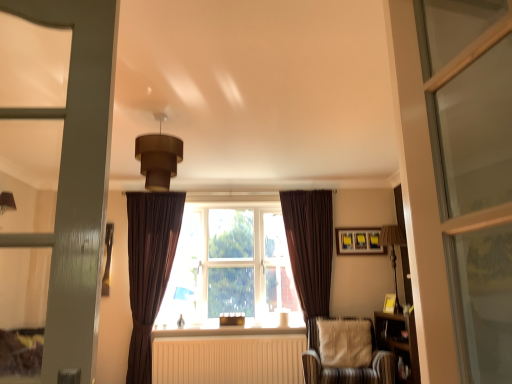
Image resolution: width=512 pixels, height=384 pixels. Describe the element at coordinates (149, 269) in the screenshot. I see `brown velvet curtain at left, the 2th curtain viewed from the right` at that location.

Where is `brown matte/soft pendant light at upper center, the first light fixture positioned from the front`? brown matte/soft pendant light at upper center, the first light fixture positioned from the front is located at coordinates (158, 157).

This screenshot has height=384, width=512. What do you see at coordinates (359, 241) in the screenshot?
I see `matte yellow picture frame at upper right` at bounding box center [359, 241].

Measure the distance between striped fabric chair at lower right and camera.

striped fabric chair at lower right is 3.59 meters away from camera.

Describe the element at coordinates (393, 251) in the screenshot. The height and width of the screenshot is (384, 512). I see `wooden lampshade at right, marked as the 2th light fixture in a front-to-back arrangement` at that location.

Image resolution: width=512 pixels, height=384 pixels. Find the location of `brown fabric window at center`. brown fabric window at center is located at coordinates (231, 268).

I want to click on brown velvet curtain at left, which is the first curtain from left to right, so click(149, 269).

From a real-world perspective, relative to white matte radiator at center, is matte yellow picture frame at upper right vertically above or below?

Clearly, from a real-world perspective, matte yellow picture frame at upper right is above white matte radiator at center.

Based on the photo, which of these two, matte yellow picture frame at upper right or white matte radiator at center, is smaller?

Smaller between the two is matte yellow picture frame at upper right.

Based on the photo, from the image's perspective, relative to white matte radiator at center, is matte yellow picture frame at upper right above or below?

matte yellow picture frame at upper right is above white matte radiator at center.

Which of these two, matte yellow picture frame at upper right or white matte radiator at center, is wider?

With larger width is white matte radiator at center.

Considering the points (146, 199) and (386, 337), which point is behind, point (146, 199) or point (386, 337)?

Positioned behind is point (146, 199).

Considering the sizes of brown velvet curtain at left, which is the first curtain from left to right, and wooden bookshelf at right in the image, is brown velvet curtain at left, which is the first curtain from left to right, wider or thinner than wooden bookshelf at right?

Considering their sizes, brown velvet curtain at left, which is the first curtain from left to right, looks slimmer than wooden bookshelf at right.

Looking at this image, is brown velvet curtain at left, which is the first curtain from left to right, positioned in front of wooden bookshelf at right?

That is False.

Measure the distance between brown velvet curtain at left, which is the first curtain from left to right, and wooden bookshelf at right.

The distance of brown velvet curtain at left, which is the first curtain from left to right, from wooden bookshelf at right is 2.44 meters.

Which object is closer to the camera, matte yellow picture frame at upper right or brown fabric window at center?

brown fabric window at center is closer to the camera.

Is matte yellow picture frame at upper right oriented towards brown fabric window at center?

No, matte yellow picture frame at upper right is not oriented towards brown fabric window at center.

Considering the sizes of objects matte yellow picture frame at upper right and brown fabric window at center in the image provided, who is thinner, matte yellow picture frame at upper right or brown fabric window at center?

matte yellow picture frame at upper right is thinner.

Looking at their sizes, would you say white painted wood at center is wider or thinner than striped fabric chair at lower right?

Clearly, white painted wood at center has less width compared to striped fabric chair at lower right.

From the image's perspective, is white painted wood at center above striped fabric chair at lower right?

Yes, from the image's perspective, white painted wood at center is over striped fabric chair at lower right.

From a real-world perspective, between white painted wood at center and striped fabric chair at lower right, who is vertically higher?

white painted wood at center.

Does point (282, 329) lie behind point (375, 363)?

Yes, point (282, 329) is farther from viewer.

From the image's perspective, between matte yellow picture frame at upper right and striped fabric chair at lower right, which one is located above?

matte yellow picture frame at upper right, from the image's perspective.

Is matte yellow picture frame at upper right next to striped fabric chair at lower right and touching it?

No, matte yellow picture frame at upper right is not making contact with striped fabric chair at lower right.

Between matte yellow picture frame at upper right and striped fabric chair at lower right, which one has larger size?

With larger size is striped fabric chair at lower right.

Which is in front, point (366, 249) or point (182, 146)?

Point (182, 146)

Who is taller, matte yellow picture frame at upper right or brown matte/soft pendant light at upper center, which ranks as the second light fixture in right-to-left order?

brown matte/soft pendant light at upper center, which ranks as the second light fixture in right-to-left order, is taller.

Does matte yellow picture frame at upper right have a lesser width compared to brown matte/soft pendant light at upper center, which ranks as the second light fixture in right-to-left order?

Yes, matte yellow picture frame at upper right is thinner than brown matte/soft pendant light at upper center, which ranks as the second light fixture in right-to-left order.

From a real-world perspective, relative to brown matte/soft pendant light at upper center, the second light fixture in the bottom-to-top sequence, is matte yellow picture frame at upper right vertically above or below?

In terms of real-world spatial position, matte yellow picture frame at upper right is below brown matte/soft pendant light at upper center, the second light fixture in the bottom-to-top sequence.

How different are the orientations of matte yellow picture frame at upper right and brown velvet curtain at left, the 2th curtain viewed from the right, in degrees?

The angle between the facing direction of matte yellow picture frame at upper right and the facing direction of brown velvet curtain at left, the 2th curtain viewed from the right, is 1.92 degrees.

From the image's perspective, would you say matte yellow picture frame at upper right is shown under brown velvet curtain at left, which is the first curtain from left to right?

No, from the image's perspective, matte yellow picture frame at upper right is not beneath brown velvet curtain at left, which is the first curtain from left to right.

Between matte yellow picture frame at upper right and brown velvet curtain at left, which is the first curtain from left to right, which one has less height?

With less height is matte yellow picture frame at upper right.

Is brown velvet curtain at left, which is the first curtain from left to right, at the back of matte yellow picture frame at upper right?

No.

The width and height of the screenshot is (512, 384). In the image, there is a white matte radiator at center. Identify the location of picture frame above it (from the image's perspective). (359, 241).

Where is `the 2nd curtain positioned above the wooden bookshelf at right (from a real-world perspective)`? The image size is (512, 384). the 2nd curtain positioned above the wooden bookshelf at right (from a real-world perspective) is located at coordinates (149, 269).

Looking at the image, which one is located further to wooden lampshade at right, which is counted as the second light fixture, starting from the left, brown velvet curtain at right, which is the 1th curtain in right-to-left order, or brown fabric window at center?

brown fabric window at center is positioned further to the anchor wooden lampshade at right, which is counted as the second light fixture, starting from the left.

Based on their spatial positions, is wooden lampshade at right, which is counted as the 1th light fixture, starting from the back, or white painted wood at center further from white matte radiator at center?

wooden lampshade at right, which is counted as the 1th light fixture, starting from the back.

From the image, which object appears to be farther from white matte radiator at center, brown velvet curtain at right, which ranks as the 2th curtain in left-to-right order, or wooden bookshelf at right?

wooden bookshelf at right is further to white matte radiator at center.

Which object lies further to the anchor point brown velvet curtain at right, which ranks as the 2th curtain in left-to-right order, brown velvet curtain at left, the 2th curtain viewed from the right, or brown matte/soft pendant light at upper center, the first light fixture positioned from the front?

brown matte/soft pendant light at upper center, the first light fixture positioned from the front, is positioned further to the anchor brown velvet curtain at right, which ranks as the 2th curtain in left-to-right order.

Estimate the real-world distances between objects in this image. Which object is closer to wooden bookshelf at right, white matte radiator at center or brown velvet curtain at left, the 2th curtain viewed from the right?

The object closer to wooden bookshelf at right is white matte radiator at center.

Estimate the real-world distances between objects in this image. Which object is further from white painted wood at center, wooden bookshelf at right or wooden lampshade at right, which is counted as the second light fixture, starting from the left?

Based on the image, wooden lampshade at right, which is counted as the second light fixture, starting from the left, appears to be further to white painted wood at center.

Looking at this image, considering their positions, is wooden bookshelf at right positioned further to brown velvet curtain at right, which ranks as the 2th curtain in left-to-right order, than matte yellow picture frame at upper right?

Among the two, wooden bookshelf at right is located further to brown velvet curtain at right, which ranks as the 2th curtain in left-to-right order.

Estimate the real-world distances between objects in this image. Which object is further from brown fabric window at center, brown matte/soft pendant light at upper center, the first light fixture positioned from the front, or white matte radiator at center?

brown matte/soft pendant light at upper center, the first light fixture positioned from the front, lies further to brown fabric window at center than the other object.

Locate an element on the screen. This screenshot has width=512, height=384. radiator between white painted wood at center and striped fabric chair at lower right is located at coordinates (229, 359).

The image size is (512, 384). I want to click on window sill between brown velvet curtain at left, the 2th curtain viewed from the right, and wooden bookshelf at right from left to right, so click(x=230, y=329).

The height and width of the screenshot is (384, 512). Find the location of `chair located between brown matte/soft pendant light at upper center, positioned as the first light fixture in left-to-right order, and wooden lampshade at right, which is counted as the 1th light fixture, starting from the back, in the left-right direction`. chair located between brown matte/soft pendant light at upper center, positioned as the first light fixture in left-to-right order, and wooden lampshade at right, which is counted as the 1th light fixture, starting from the back, in the left-right direction is located at coordinates (347, 368).

Locate an element on the screen. This screenshot has height=384, width=512. curtain located between white painted wood at center and striped fabric chair at lower right in the left-right direction is located at coordinates (310, 250).